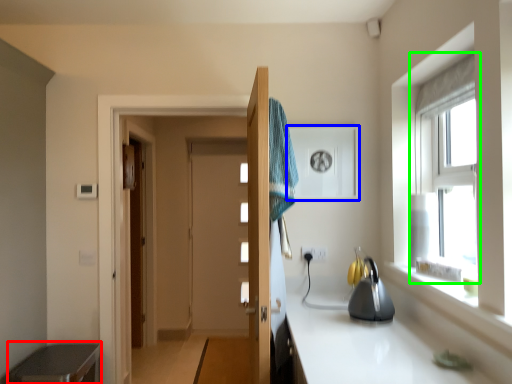
Question: Which object is the closest to the cabinetry (highlighted by a red box)? Choose among these: medicine cabinet (highlighted by a blue box) or window (highlighted by a green box).

Choices:
 (A) medicine cabinet
 (B) window

Answer: (A)